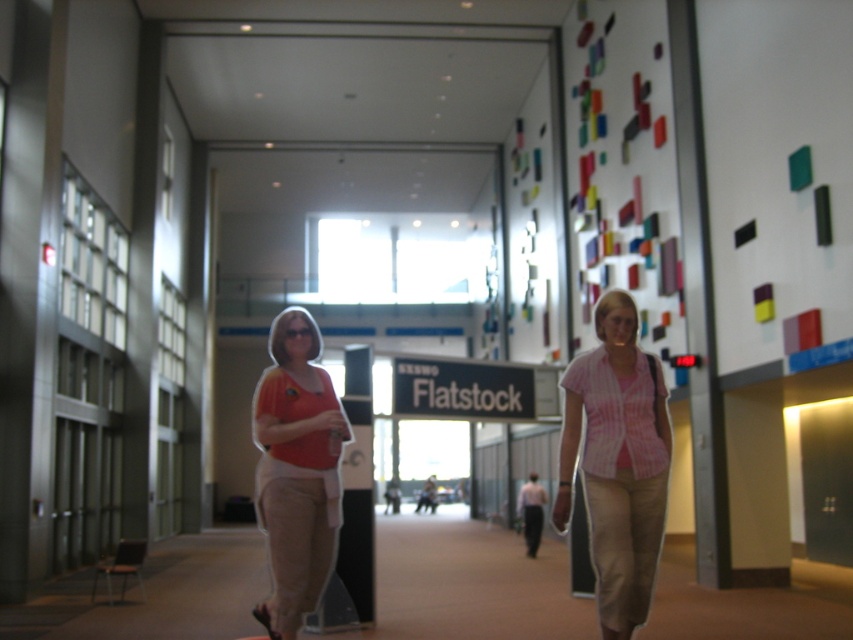
Question: Does pink striped shirt at center appear under matte orange shirt at center?

Choices:
 (A) yes
 (B) no

Answer: (A)

Question: Is pink striped shirt at center bigger than matte orange shirt at center?

Choices:
 (A) yes
 (B) no

Answer: (A)

Question: Among these objects, which one is nearest to the camera?

Choices:
 (A) matte orange shirt at center
 (B) pink striped shirt at center

Answer: (B)

Question: Among these objects, which one is nearest to the camera?

Choices:
 (A) pink striped shirt at center
 (B) matte orange shirt at center

Answer: (A)

Question: Can you confirm if pink striped shirt at center is thinner than matte orange shirt at center?

Choices:
 (A) no
 (B) yes

Answer: (A)